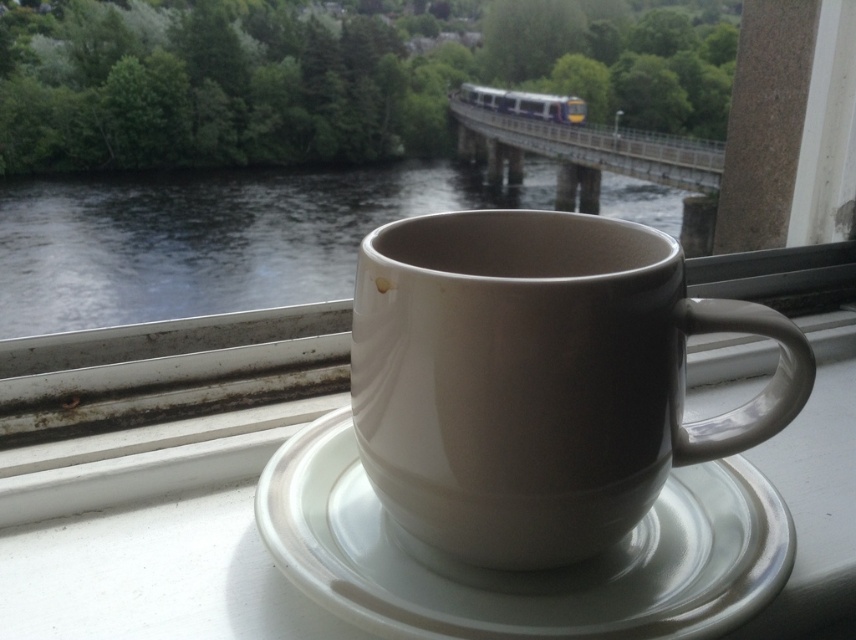
Question: Which of the following is the closest to the observer?

Choices:
 (A) metallic silver train at center
 (B) dark water at center

Answer: (B)

Question: Which point is closer to the camera?

Choices:
 (A) (545, 118)
 (B) (488, 388)

Answer: (B)

Question: Is white glossy saucer at center behind metallic silver train at center?

Choices:
 (A) yes
 (B) no

Answer: (B)

Question: Does white glossy saucer at center have a lesser width compared to dark water at center?

Choices:
 (A) no
 (B) yes

Answer: (B)

Question: Is dark water at center in front of metallic silver train at center?

Choices:
 (A) yes
 (B) no

Answer: (A)

Question: Which of these objects is positioned farthest from the dark water at center?

Choices:
 (A) metallic silver train at center
 (B) matte ceramic mug at center
 (C) white glossy saucer at center

Answer: (B)